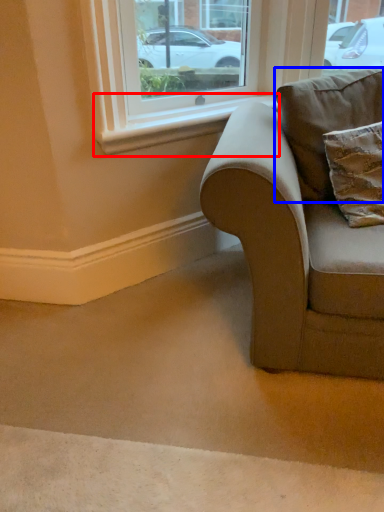
Question: Which point is closer to the camera, window sill (highlighted by a red box) or pillow (highlighted by a blue box)?

Choices:
 (A) window sill
 (B) pillow

Answer: (B)